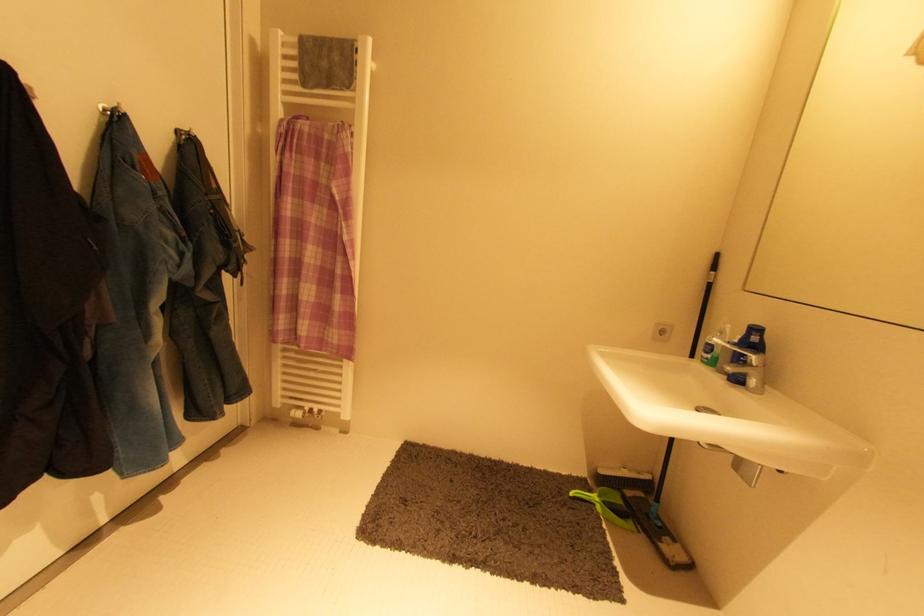
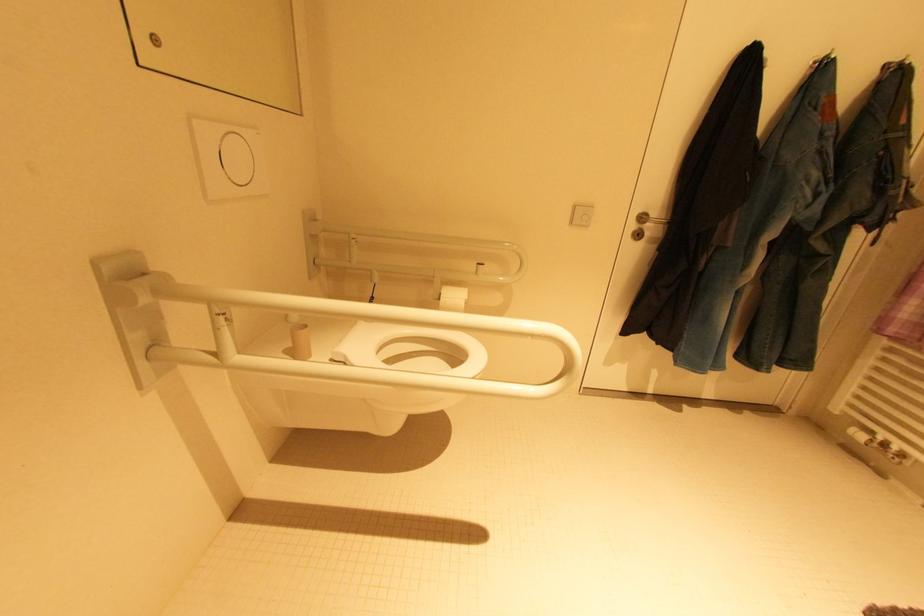
Question: The images are taken continuously from a first-person perspective. In which direction is your viewpoint rotating?

Choices:
 (A) Left
 (B) Right
 (C) Up
 (D) Down

Answer: (A)